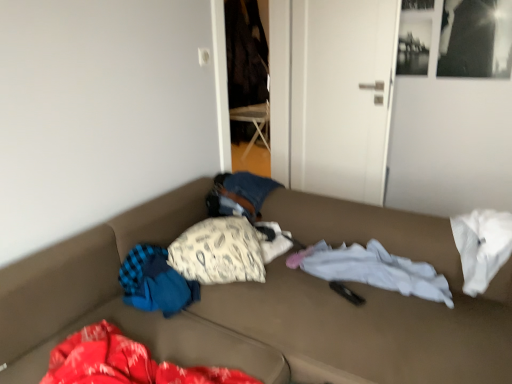
Question: From the image's perspective, is brown fabric couch at center beneath white matte door at center?

Choices:
 (A) no
 (B) yes

Answer: (B)

Question: Considering the relative sizes of brown fabric couch at center and white matte door at center in the image provided, is brown fabric couch at center taller than white matte door at center?

Choices:
 (A) yes
 (B) no

Answer: (B)

Question: Can you confirm if brown fabric couch at center is thinner than white matte door at center?

Choices:
 (A) yes
 (B) no

Answer: (B)

Question: From a real-world perspective, is brown fabric couch at center located higher than white matte door at center?

Choices:
 (A) no
 (B) yes

Answer: (A)

Question: Is white matte door at center at the back of brown fabric couch at center?

Choices:
 (A) no
 (B) yes

Answer: (A)

Question: Does point (377, 281) appear closer or farther from the camera than point (216, 269)?

Choices:
 (A) closer
 (B) farther

Answer: (A)

Question: Considering their positions, is white soft fabric at center located in front of or behind white fabric pillow at center?

Choices:
 (A) behind
 (B) front

Answer: (B)

Question: From their relative heights in the image, would you say white soft fabric at center is taller or shorter than white fabric pillow at center?

Choices:
 (A) short
 (B) tall

Answer: (A)

Question: From a real-world perspective, is white soft fabric at center above or below white fabric pillow at center?

Choices:
 (A) above
 (B) below

Answer: (B)

Question: Is white matte door at center in front of or behind brown fabric couch at center in the image?

Choices:
 (A) behind
 (B) front

Answer: (A)

Question: Considering the relative positions of white matte door at center and brown fabric couch at center in the image provided, is white matte door at center to the left or to the right of brown fabric couch at center?

Choices:
 (A) left
 (B) right

Answer: (B)

Question: In terms of height, does white matte door at center look taller or shorter compared to brown fabric couch at center?

Choices:
 (A) short
 (B) tall

Answer: (B)

Question: Does point (381, 79) appear closer or farther from the camera than point (41, 266)?

Choices:
 (A) farther
 (B) closer

Answer: (A)

Question: Is white fabric pillow at center taller or shorter than white matte door at center?

Choices:
 (A) short
 (B) tall

Answer: (A)

Question: Is point (174, 246) positioned closer to the camera than point (362, 114)?

Choices:
 (A) farther
 (B) closer

Answer: (B)